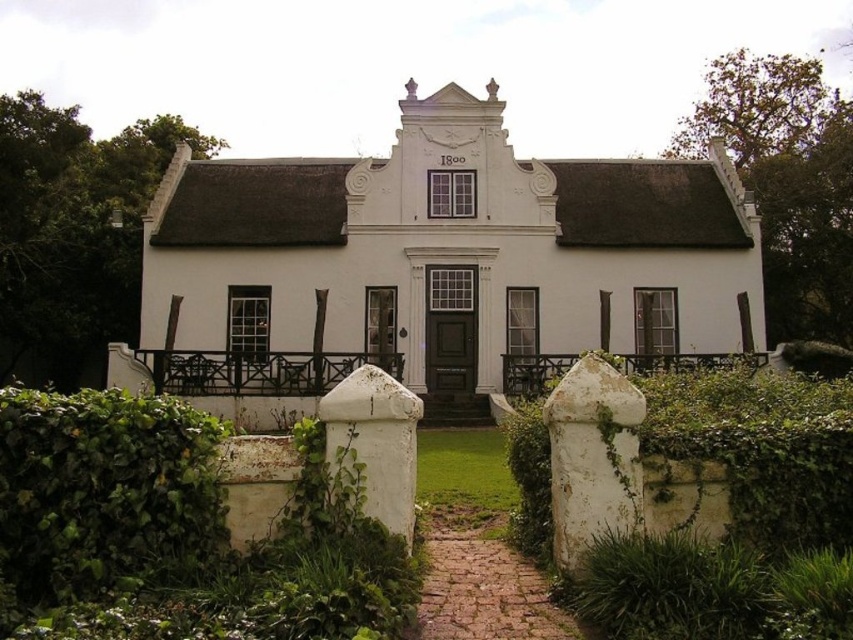
Can you confirm if brick paved path at center is positioned above wooden/rustic fence at center?

Actually, brick paved path at center is below wooden/rustic fence at center.

Is point (432, 625) closer to viewer compared to point (215, 380)?

Yes, point (432, 625) is closer to viewer.

Image resolution: width=853 pixels, height=640 pixels. Find the location of `brick paved path at center`. brick paved path at center is located at coordinates pyautogui.click(x=483, y=582).

Which is below, brick paved path at center or white wooden fence at center?

brick paved path at center is below.

Is brick paved path at center positioned before white wooden fence at center?

No, brick paved path at center is further to the viewer.

Measure the distance between point (x=445, y=612) and camera.

Point (x=445, y=612) is 26.95 feet from camera.

Find the location of a particular element. The width and height of the screenshot is (853, 640). brick paved path at center is located at coordinates (483, 582).

Based on the photo, does green leafy hedge at lower left have a lesser width compared to white wooden fence at center?

Yes.

Does green leafy hedge at lower left appear over white wooden fence at center?

No.

Which is in front, point (143, 548) or point (634, 365)?

Point (143, 548) is more forward.

Find the location of a particular element. The height and width of the screenshot is (640, 853). green leafy hedge at lower left is located at coordinates pos(103,492).